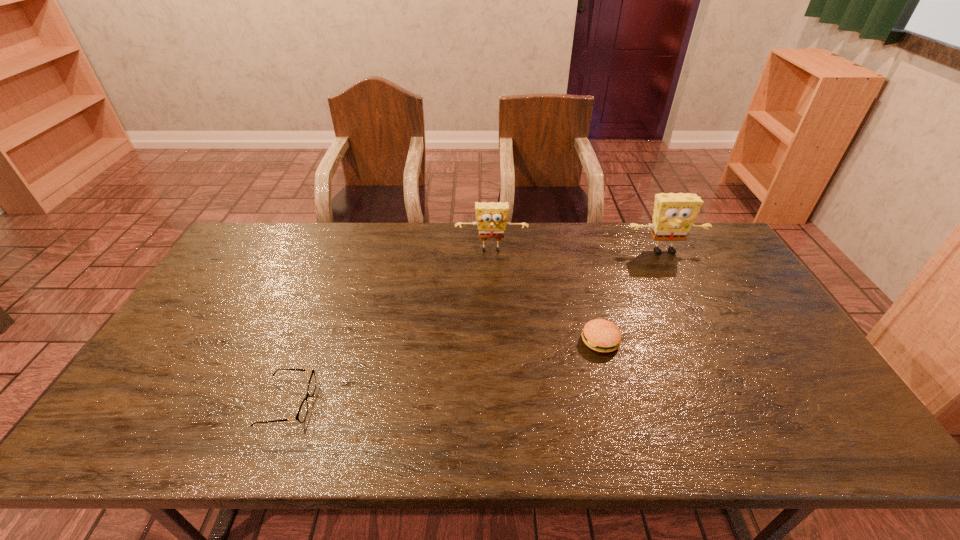
The width and height of the screenshot is (960, 540). Identify the location of vacant point located between the third tallest object and the spectacles. click(x=444, y=373).

Locate an element on the screen. Image resolution: width=960 pixels, height=540 pixels. free area in between the patty and the shortest object is located at coordinates tap(444, 373).

You are a GUI agent. You are given a task and a screenshot of the screen. Output one action in this format:
    pyautogui.click(x=<x>, y=<y>)
    Task: Click on the unoccupied position between the third shortest object and the spectacles
    This screenshot has width=960, height=540.
    Given the screenshot: What is the action you would take?
    pyautogui.click(x=390, y=327)

Where is `unoccupied area between the shorter sponge and the leftmost object`? unoccupied area between the shorter sponge and the leftmost object is located at coordinates (390, 327).

I want to click on empty location between the left sponge and the leftmost object, so click(x=390, y=327).

Locate an element on the screen. The image size is (960, 540). free space between the taller sponge and the spectacles is located at coordinates (475, 327).

In order to click on vacant area that lies between the third farthest object and the shortest object in this screenshot , I will do `click(444, 373)`.

Where is `vacant space that's between the second object from left to right and the taller sponge`? The image size is (960, 540). vacant space that's between the second object from left to right and the taller sponge is located at coordinates (578, 251).

Locate an element on the screen. This screenshot has height=540, width=960. vacant area that lies between the taller sponge and the left sponge is located at coordinates (578, 251).

This screenshot has width=960, height=540. I want to click on free space between the nearest object and the third object from left to right, so click(x=444, y=373).